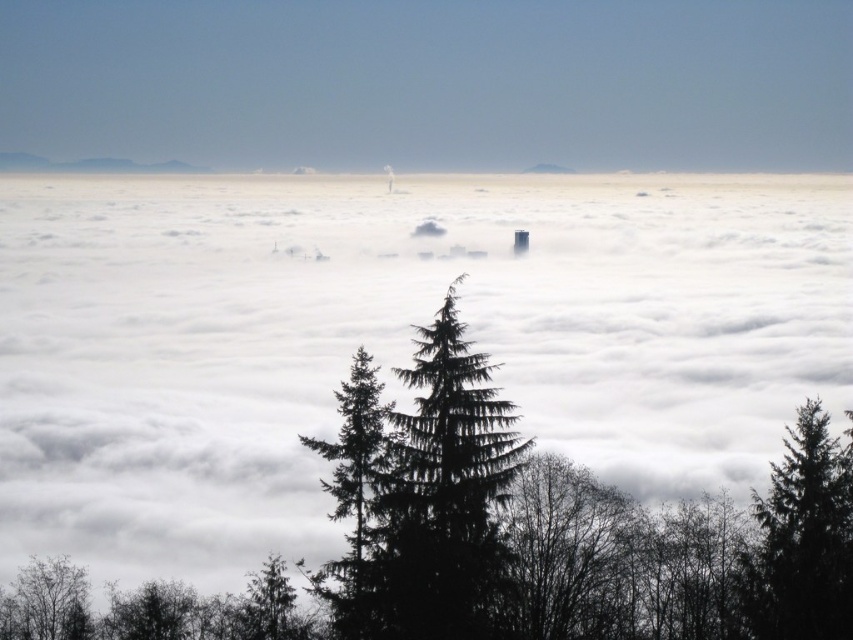
You are an architect designing a new observation deck. You want to ensure visitors can see both the green textured pine tree at center and the gray foggy peak at center. Given their widths, which object will require more space to accommodate its view?

The gray foggy peak at center requires more space because it has a greater width than the green textured pine tree at center.

From the picture: You are an architect designing a new park and want to incorporate elements from this landscape. You have two tree options to place in the park layout. The green matte tree at lower right and the silhouette leafy tree at lower left. According to the scene, which tree should be placed higher in the design to match the original composition?

The green matte tree at lower right should be placed higher in the design because it is positioned above the silhouette leafy tree at lower left in the original scene.

You are an observer standing in the middle of the scene. You see the green matte tree at lower right and the silhouette leafy tree at lower left. Which tree would block your view of the cityscape in the midground if you were to stand directly in front of it?

The green matte tree at lower right is much taller than the silhouette leafy tree at lower left, so it would block your view of the cityscape in the midground if you were to stand directly in front of it.